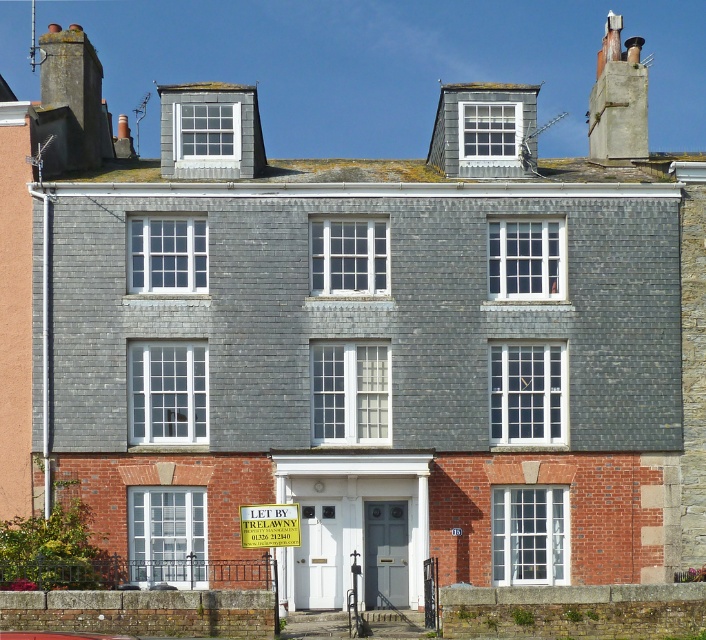
Is concrete chimney at upper right to the right of yellow paper sign at center from the viewer's perspective?

Indeed, concrete chimney at upper right is positioned on the right side of yellow paper sign at center.

From the picture: Who is positioned more to the left, concrete chimney at upper right or yellow paper sign at center?

Positioned to the left is yellow paper sign at center.

Which is behind, point (599, 51) or point (244, 508)?

Positioned behind is point (599, 51).

Locate an element on the screen. This screenshot has width=706, height=640. concrete chimney at upper right is located at coordinates (618, 97).

Is smooth stone chimney at upper left thinner than yellow paper sign at center?

No, smooth stone chimney at upper left is not thinner than yellow paper sign at center.

Does smooth stone chimney at upper left appear over yellow paper sign at center?

Yes, smooth stone chimney at upper left is above yellow paper sign at center.

The image size is (706, 640). What do you see at coordinates (73, 84) in the screenshot?
I see `smooth stone chimney at upper left` at bounding box center [73, 84].

Locate an element on the screen. smooth stone chimney at upper left is located at coordinates (73, 84).

Looking at this image, who is positioned more to the right, concrete chimney at upper right or smooth stone chimney at upper left?

concrete chimney at upper right is more to the right.

Between point (635, 83) and point (83, 58), which one is positioned in front?

Point (83, 58) is in front.

In order to click on concrete chimney at upper right in this screenshot , I will do `click(618, 97)`.